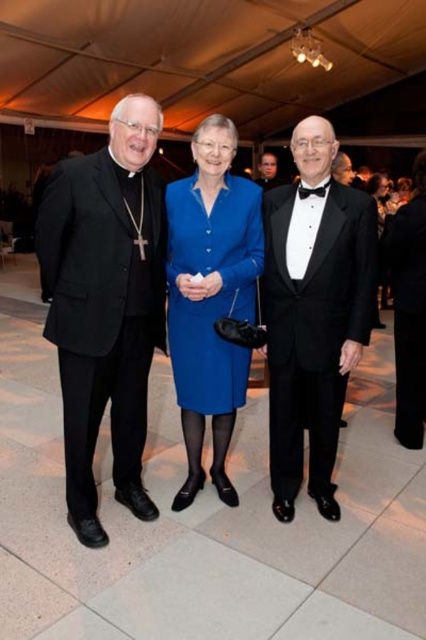
Is matte blue dress at center above black satin bow tie at center?

No.

Who is taller, matte blue dress at center or black satin bow tie at center?

With more height is matte blue dress at center.

Is point (221, 410) farther from camera compared to point (298, 189)?

Yes, it is behind point (298, 189).

This screenshot has width=426, height=640. I want to click on matte blue dress at center, so click(210, 298).

Can you confirm if black satin tuxedo at right is bigger than smooth black suit at center?

No, black satin tuxedo at right is not bigger than smooth black suit at center.

Measure the distance from black satin tuxedo at right to smooth black suit at center.

The distance of black satin tuxedo at right from smooth black suit at center is 9.49 feet.

Is point (423, 275) closer to camera compared to point (268, 179)?

Yes, it is.

At what (x,y) coordinates should I click in order to perform the action: click on black satin tuxedo at right. Please return your answer as a coordinate pair (x, y). Looking at the image, I should click on (408, 316).

Which is more to the right, matte black suit at center or black matte suit at left?

matte black suit at center is more to the right.

Who is more distant from viewer, (x=40, y=250) or (x=89, y=456)?

The point (x=89, y=456) is more distant.

Between point (121, 157) and point (129, 506), which one is positioned behind?

The point (129, 506) is more distant.

At what (x,y) coordinates should I click in order to perform the action: click on matte black suit at center. Please return your answer as a coordinate pair (x, y). The width and height of the screenshot is (426, 640). Looking at the image, I should click on (106, 304).